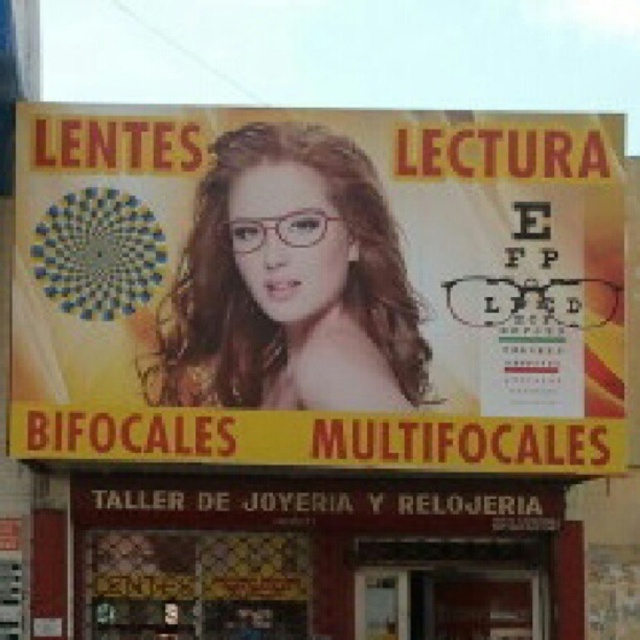
Locate an element on the screen. matte plastic glasses at upper center is located at coordinates (317, 288).

Can you confirm if matte plastic glasses at upper center is positioned below matte pink glasses at center?

Actually, matte plastic glasses at upper center is above matte pink glasses at center.

Find the location of a particular element. matte plastic glasses at upper center is located at coordinates (317, 288).

Who is positioned more to the right, brown wood sign at lower center or matte pink glasses at center?

brown wood sign at lower center

Does point (232, 488) come closer to viewer compared to point (376, 275)?

That is False.

The image size is (640, 640). Identify the location of brown wood sign at lower center. (323, 557).

Who is more distant from viewer, (x=422, y=154) or (x=529, y=557)?

The point (x=529, y=557) is behind.

Does matte plastic glasses at upper center have a greater width compared to brown wood sign at lower center?

Indeed, matte plastic glasses at upper center has a greater width compared to brown wood sign at lower center.

Is point (280, 176) positioned before point (156, 573)?

Yes, point (280, 176) is in front of point (156, 573).

Image resolution: width=640 pixels, height=640 pixels. Find the location of `matte plastic glasses at upper center`. matte plastic glasses at upper center is located at coordinates (317, 288).